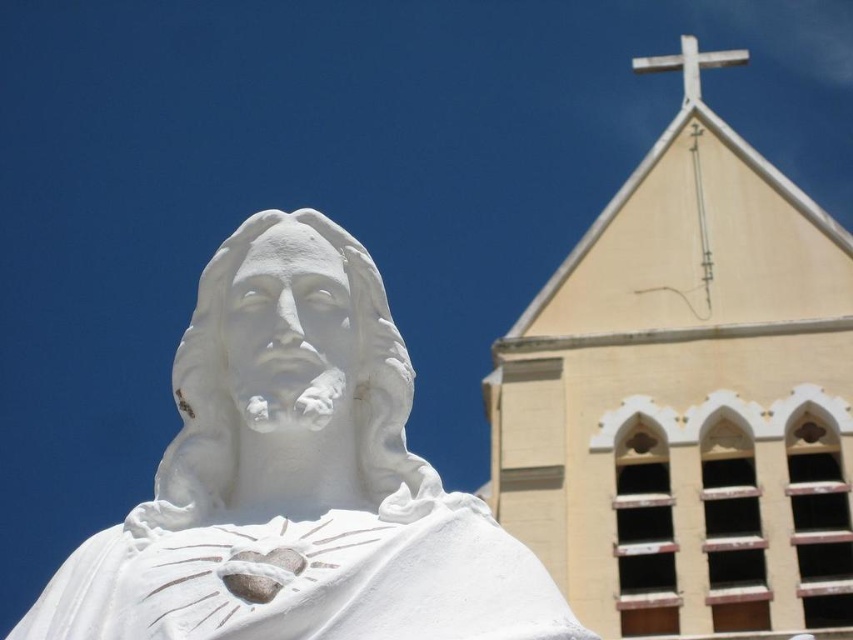
Is white marble statue at center above white wooden cross at upper center?

No.

Does white marble statue at center have a lesser height compared to white wooden cross at upper center?

Indeed, white marble statue at center has a lesser height compared to white wooden cross at upper center.

Between point (152, 508) and point (660, 58), which one is positioned in front?

Point (152, 508)

Locate an element on the screen. This screenshot has width=853, height=640. white marble statue at center is located at coordinates (297, 480).

Is point (622, 632) positioned after point (171, 580)?

Yes, it is behind point (171, 580).

Is point (828, 500) positioned before point (323, 545)?

No, (828, 500) is behind (323, 545).

I want to click on beige stone church at upper right, so click(688, 403).

Between beige stone church at upper right and white wooden cross at upper center, which one is positioned lower?

beige stone church at upper right

Where is `beige stone church at upper right`? This screenshot has width=853, height=640. beige stone church at upper right is located at coordinates pos(688,403).

Image resolution: width=853 pixels, height=640 pixels. In order to click on beige stone church at upper right in this screenshot , I will do `click(688, 403)`.